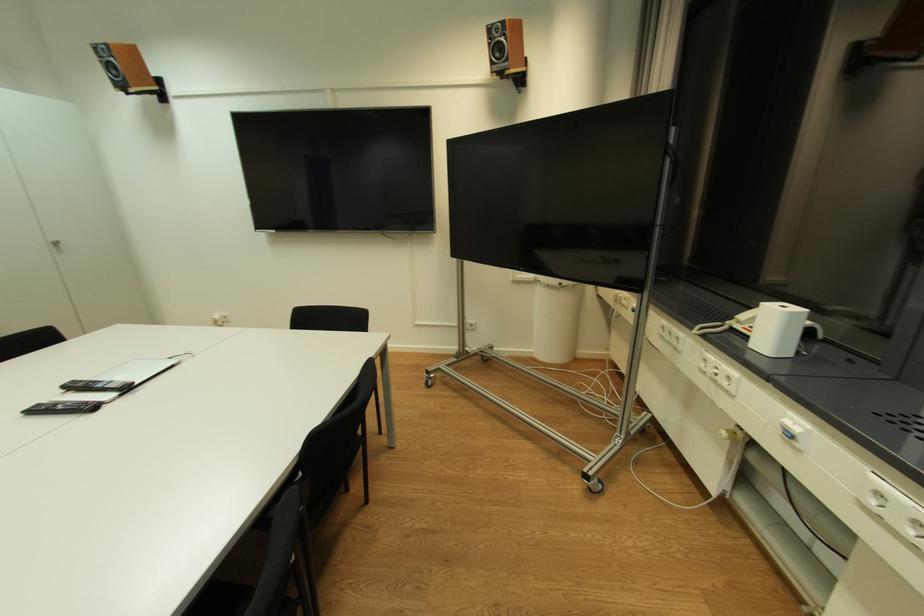
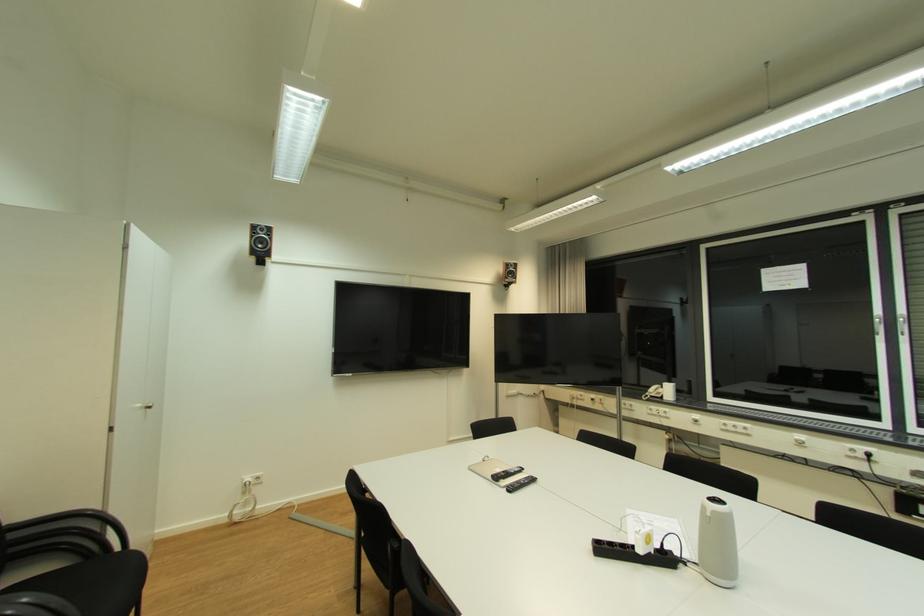
The point at (103,52) is marked in the first image. Where is the corresponding point in the second image?

(261, 228)